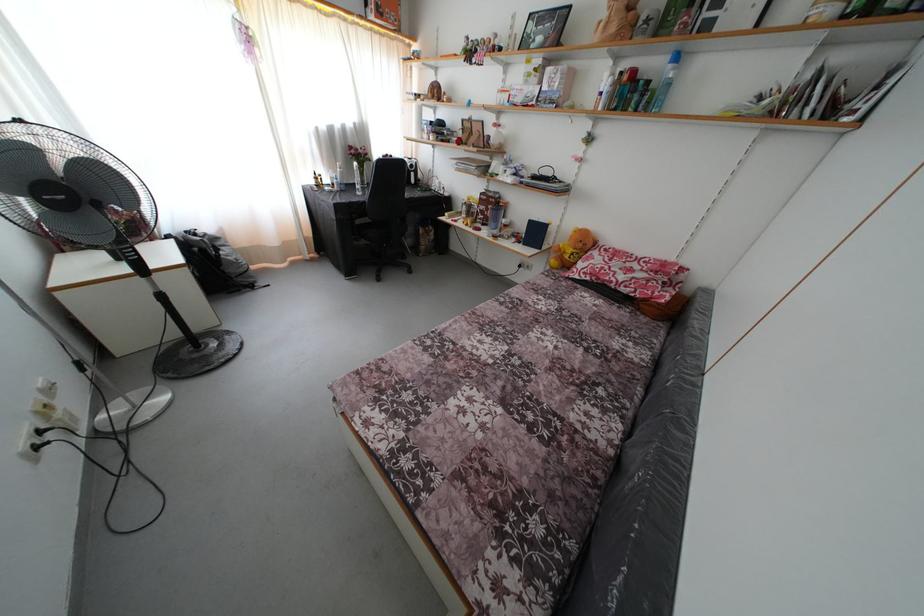
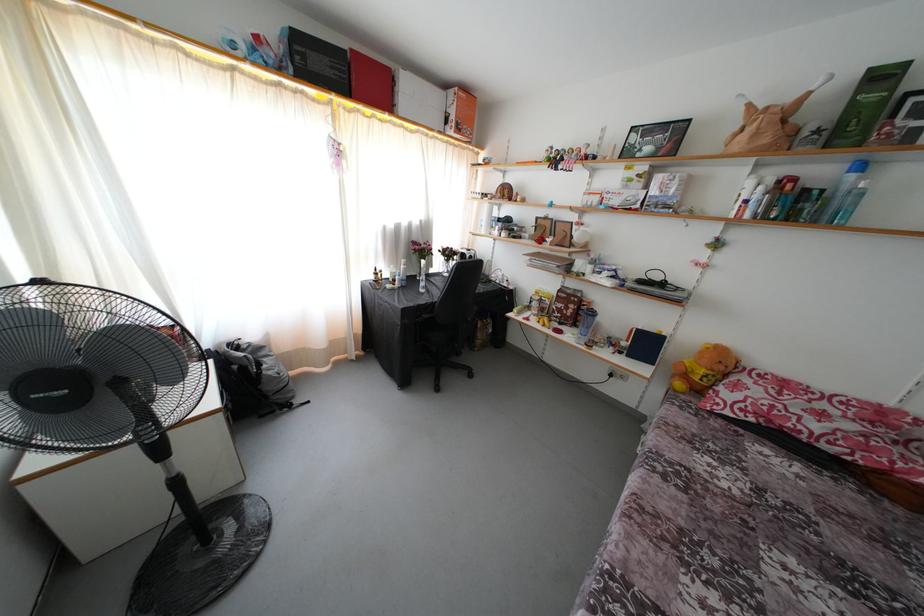
Question: The first image is from the beginning of the video and the second image is from the end. How did the camera likely rotate when shooting the video?

Choices:
 (A) Left
 (B) Right
 (C) Up
 (D) Down

Answer: (C)